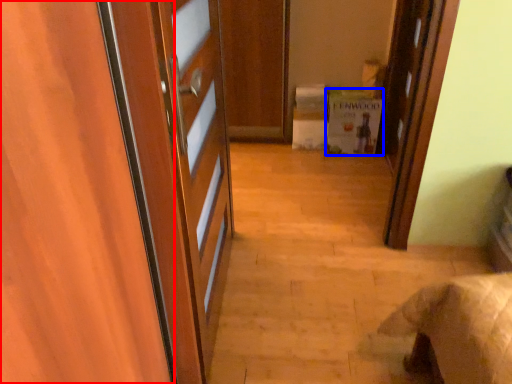
Question: Which point is closer to the camera, door (highlighted by a red box) or cabinetry (highlighted by a blue box)?

Choices:
 (A) door
 (B) cabinetry

Answer: (A)